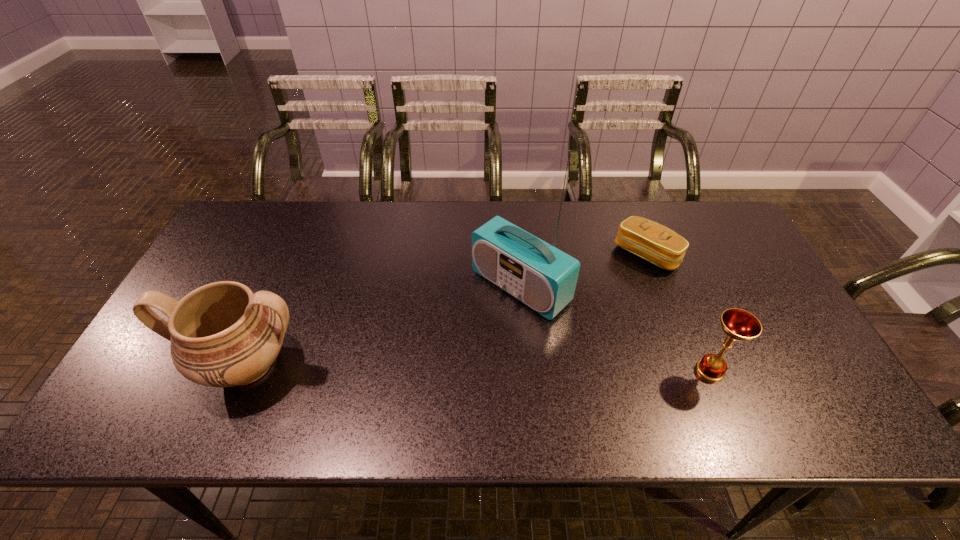
I want to click on vacant space located 0.280m on the zipper side of the clutch bag, so click(568, 320).

At what (x,y) coordinates should I click in order to perform the action: click on vacant area located 0.210m on the zipper side of the clutch bag. Please return your answer as a coordinate pair (x, y). This screenshot has height=540, width=960. Looking at the image, I should click on (585, 306).

Find the location of a particular element. vacant region located 0.230m on the zipper side of the clutch bag is located at coordinates (581, 310).

This screenshot has height=540, width=960. I want to click on object at the far edge, so click(651, 241).

At what (x,y) coordinates should I click in order to perform the action: click on urn present at the near edge. Please return your answer as a coordinate pair (x, y). Looking at the image, I should click on (222, 334).

Where is `chalice present at the near edge`? This screenshot has width=960, height=540. chalice present at the near edge is located at coordinates (739, 325).

Find the location of a particular element. object located at the left edge is located at coordinates (222, 334).

This screenshot has height=540, width=960. What are the coordinates of `object present at the near left corner` in the screenshot? It's located at (222, 334).

Find the location of `blank space at the far edge of the desktop`. blank space at the far edge of the desktop is located at coordinates (424, 215).

The height and width of the screenshot is (540, 960). Find the location of `vacant space at the near edge of the desktop`. vacant space at the near edge of the desktop is located at coordinates (280, 384).